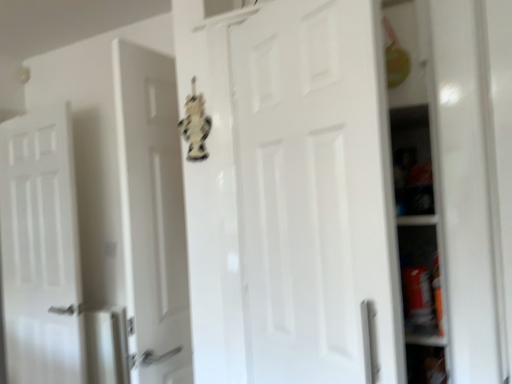
Find the location of a particular element. Image resolution: width=512 pixels, height=384 pixels. white matte door at left, which appears as the second door when viewed from the front is located at coordinates (40, 250).

Describe the element at coordinates (40, 250) in the screenshot. I see `white matte door at left, positioned as the 1th door in left-to-right order` at that location.

Where is `white matte door at center, which is counted as the first door, starting from the front`? Image resolution: width=512 pixels, height=384 pixels. white matte door at center, which is counted as the first door, starting from the front is located at coordinates (317, 195).

What do you see at coordinates (317, 195) in the screenshot? The height and width of the screenshot is (384, 512). I see `white matte door at center, the second door positioned from the back` at bounding box center [317, 195].

I want to click on white matte door at left, positioned as the 1th door in left-to-right order, so click(40, 250).

Considering the positions of objects white matte door at left, which is the first door in back-to-front order, and white matte door at center, the first door in the right-to-left sequence, in the image provided, who is more to the left, white matte door at left, which is the first door in back-to-front order, or white matte door at center, the first door in the right-to-left sequence,?

white matte door at left, which is the first door in back-to-front order.

Which is in front, white matte door at left, which is the first door in back-to-front order, or white matte door at center, the first door in the right-to-left sequence?

Positioned in front is white matte door at center, the first door in the right-to-left sequence.

Which is behind, point (38, 286) or point (314, 140)?

Point (38, 286)

From the image's perspective, who appears lower, white matte door at left, which is counted as the 2th door, starting from the right, or white matte door at center, the second door positioned from the back?

From the image's view, white matte door at left, which is counted as the 2th door, starting from the right, is below.

From a real-world perspective, does white matte door at left, which is the first door in back-to-front order, stand above white matte door at center, the first door in the right-to-left sequence?

No.

Between white matte door at left, which is counted as the 2th door, starting from the right, and white matte door at center, which is counted as the first door, starting from the front, which one has larger width?

white matte door at left, which is counted as the 2th door, starting from the right, is wider.

Is white matte door at left, positioned as the 1th door in left-to-right order, shorter than white matte door at center, the 2th door viewed from the left?

Incorrect, the height of white matte door at left, positioned as the 1th door in left-to-right order, does not fall short of that of white matte door at center, the 2th door viewed from the left.

Can you confirm if white matte door at left, which is the first door in back-to-front order, is bigger than white matte door at center, the first door in the right-to-left sequence?

Correct, white matte door at left, which is the first door in back-to-front order, is larger in size than white matte door at center, the first door in the right-to-left sequence.

Does white matte door at left, which appears as the second door when viewed from the front, contain white matte door at center, which is counted as the first door, starting from the front?

No, white matte door at center, which is counted as the first door, starting from the front, is not surrounded by white matte door at left, which appears as the second door when viewed from the front.

Is white matte door at left, positioned as the 1th door in left-to-right order, with white matte door at center, which is counted as the first door, starting from the front?

white matte door at left, positioned as the 1th door in left-to-right order, is not next to white matte door at center, which is counted as the first door, starting from the front, and they're not touching.

Is white matte door at center, the 2th door viewed from the left, at the back of white matte door at left, which appears as the second door when viewed from the front?

No, white matte door at left, which appears as the second door when viewed from the front, is not facing the opposite direction of white matte door at center, the 2th door viewed from the left.

How many degrees apart are the facing directions of white matte door at left, which appears as the second door when viewed from the front, and white matte door at center, the second door positioned from the back?

The angular difference between white matte door at left, which appears as the second door when viewed from the front, and white matte door at center, the second door positioned from the back, is 20.9 degrees.

How much distance is there between white matte door at left, which appears as the second door when viewed from the front, and white matte door at center, the first door in the right-to-left sequence?

white matte door at left, which appears as the second door when viewed from the front, is 5.37 feet from white matte door at center, the first door in the right-to-left sequence.

Locate an element on the screen. door in front of the white matte door at left, positioned as the 1th door in left-to-right order is located at coordinates (317, 195).

Is white matte door at center, the second door positioned from the back, to the left or to the right of white matte door at left, which appears as the second door when viewed from the front, in the image?

In the image, white matte door at center, the second door positioned from the back, appears on the right side of white matte door at left, which appears as the second door when viewed from the front.

Looking at this image, who is more distant, white matte door at center, the first door in the right-to-left sequence, or white matte door at left, positioned as the 1th door in left-to-right order?

white matte door at left, positioned as the 1th door in left-to-right order.

Is point (365, 230) less distant than point (19, 211)?

That is True.

From the image's perspective, which is above, white matte door at center, the second door positioned from the back, or white matte door at left, which appears as the second door when viewed from the front?

white matte door at center, the second door positioned from the back, is shown above in the image.

From a real-world perspective, relative to white matte door at left, which is counted as the 2th door, starting from the right, is white matte door at center, the second door positioned from the back, vertically above or below?

white matte door at center, the second door positioned from the back, is situated higher than white matte door at left, which is counted as the 2th door, starting from the right, in the real world.

Considering the sizes of objects white matte door at center, the second door positioned from the back, and white matte door at left, positioned as the 1th door in left-to-right order, in the image provided, who is wider, white matte door at center, the second door positioned from the back, or white matte door at left, positioned as the 1th door in left-to-right order,?

white matte door at left, positioned as the 1th door in left-to-right order.

Based on the photo, considering the sizes of objects white matte door at center, which is counted as the first door, starting from the front, and white matte door at left, positioned as the 1th door in left-to-right order, in the image provided, who is taller, white matte door at center, which is counted as the first door, starting from the front, or white matte door at left, positioned as the 1th door in left-to-right order,?

With more height is white matte door at left, positioned as the 1th door in left-to-right order.

Does white matte door at center, the 2th door viewed from the left, have a smaller size compared to white matte door at left, which is counted as the 2th door, starting from the right?

Yes, white matte door at center, the 2th door viewed from the left, is smaller than white matte door at left, which is counted as the 2th door, starting from the right.

Is white matte door at left, which is counted as the 2th door, starting from the right, a part of white matte door at center, which is counted as the first door, starting from the front?

That's incorrect, white matte door at left, which is counted as the 2th door, starting from the right, is not inside white matte door at center, which is counted as the first door, starting from the front.

Is white matte door at center, which is counted as the first door, starting from the front, in contact with white matte door at left, positioned as the 1th door in left-to-right order?

There is a gap between white matte door at center, which is counted as the first door, starting from the front, and white matte door at left, positioned as the 1th door in left-to-right order.

Is white matte door at center, the 2th door viewed from the left, turned away from white matte door at left, which is the first door in back-to-front order?

No, white matte door at center, the 2th door viewed from the left,'s orientation is not away from white matte door at left, which is the first door in back-to-front order.

How many degrees apart are the facing directions of white matte door at center, the 2th door viewed from the left, and white matte door at left, which appears as the second door when viewed from the front?

The facing directions of white matte door at center, the 2th door viewed from the left, and white matte door at left, which appears as the second door when viewed from the front, are 20.9 degrees apart.

I want to click on door on the right side of white matte door at left, which appears as the second door when viewed from the front, so click(x=317, y=195).

This screenshot has width=512, height=384. I want to click on door above the white matte door at left, which appears as the second door when viewed from the front (from the image's perspective), so [317, 195].

In the image, there is a white matte door at center, which is counted as the first door, starting from the front. In order to click on door below it (from a real-world perspective) in this screenshot , I will do (x=40, y=250).